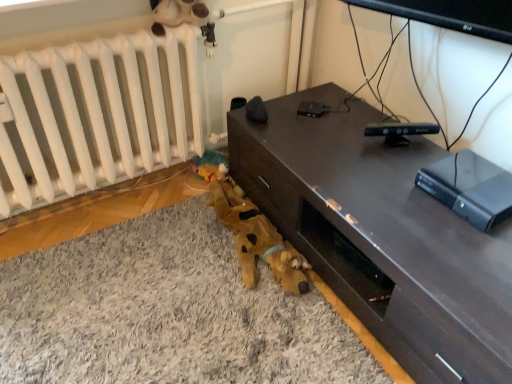
Question: Considering the positions of brown plush toy at lower left and black plastic remote control at center, the second gadget positioned from the front, in the image, is brown plush toy at lower left wider or thinner than black plastic remote control at center, the second gadget positioned from the front,?

Choices:
 (A) wide
 (B) thin

Answer: (A)

Question: From the image's perspective, is brown plush toy at lower left located above or below black plastic remote control at center, acting as the second gadget starting from the right?

Choices:
 (A) above
 (B) below

Answer: (B)

Question: Which object is positioned farthest from the black plastic gaming console at right?

Choices:
 (A) black plastic remote control at upper center, marked as the first gadget in a right-to-left arrangement
 (B) dark wood desk at center
 (C) brown plush toy at lower left
 (D) white matte radiator at lower left
 (E) black plastic remote control at center, marked as the 1th gadget in a left-to-right arrangement

Answer: (D)

Question: Estimate the real-world distances between objects in this image. Which object is closer to the black plastic remote control at upper center, marked as the first gadget in a right-to-left arrangement?

Choices:
 (A) black plastic remote control at center, the 1th gadget positioned from the top
 (B) black plastic gaming console at right
 (C) dark wood desk at center
 (D) white matte radiator at lower left
 (E) brown plush toy at lower left

Answer: (B)